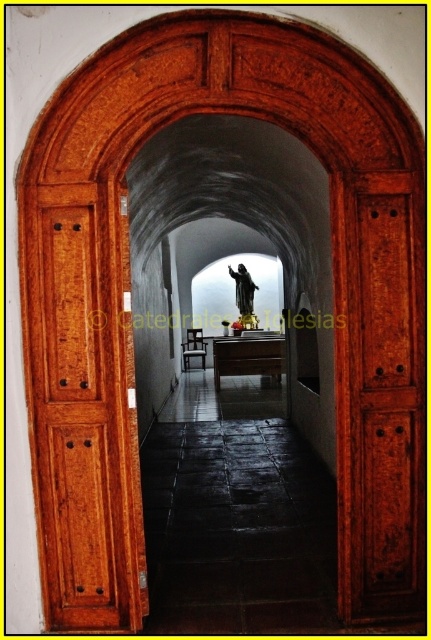
Question: Which of the following is the closest to the observer?

Choices:
 (A) black polished statue at center
 (B) wooden panelled door at left

Answer: (B)

Question: Can you confirm if wooden panelled door at left is positioned to the left of black polished statue at center?

Choices:
 (A) no
 (B) yes

Answer: (B)

Question: Is the position of wooden panelled door at left less distant than that of black polished statue at center?

Choices:
 (A) yes
 (B) no

Answer: (A)

Question: Can you confirm if wooden panelled door at left is positioned below black polished statue at center?

Choices:
 (A) yes
 (B) no

Answer: (A)